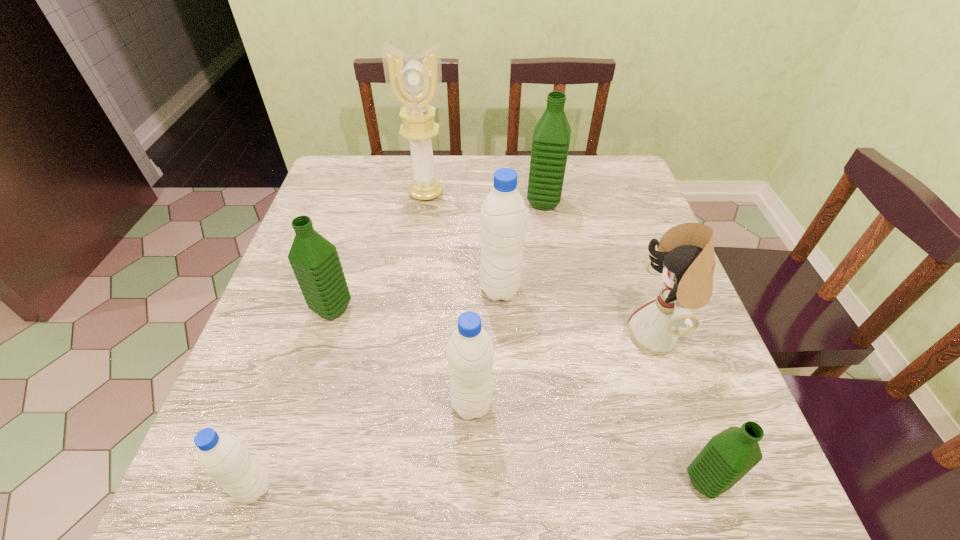
Identify the location of free region located 0.240m on the back of the second nearest green water bottle. This screenshot has height=540, width=960. (358, 225).

This screenshot has width=960, height=540. What are the coordinates of `free space located on the right of the third nearest object` in the screenshot? It's located at (682, 404).

At what (x,y) coordinates should I click in order to perform the action: click on vacant position located 0.250m on the right of the leftmost gray water bottle. Please return your answer as a coordinate pair (x, y). This screenshot has height=540, width=960. Looking at the image, I should click on (431, 488).

The height and width of the screenshot is (540, 960). I want to click on free location located 0.400m on the left of the smallest green water bottle, so click(432, 482).

Where is `award that is at the far edge`? Image resolution: width=960 pixels, height=540 pixels. award that is at the far edge is located at coordinates (414, 84).

Where is `water bottle present at the far edge`? water bottle present at the far edge is located at coordinates click(551, 138).

Where is `doll located at the right edge`? doll located at the right edge is located at coordinates (685, 259).

Where is `water bottle located in the right edge section of the desktop`? The height and width of the screenshot is (540, 960). water bottle located in the right edge section of the desktop is located at coordinates (728, 456).

Find the location of `object present at the near left corner`. object present at the near left corner is located at coordinates (222, 456).

Locate an element on the screen. This screenshot has height=540, width=960. object present at the near right corner is located at coordinates (728, 456).